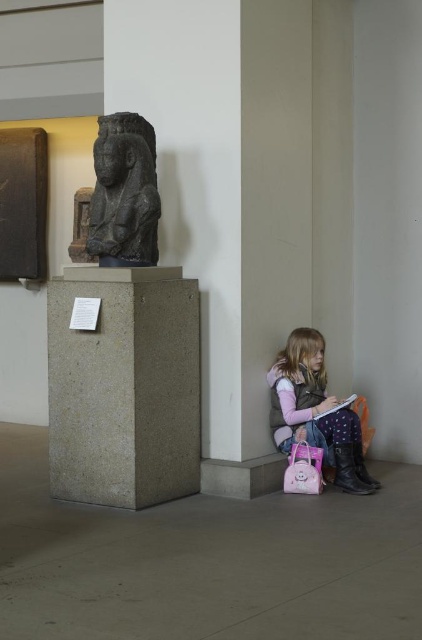
Question: Which of these objects is positioned farthest from the gray concrete pillar at center?

Choices:
 (A) matte pink backpack at lower right
 (B) pink matte book at lower right

Answer: (B)

Question: Is matte pink backpack at lower right thinner than pink matte book at lower right?

Choices:
 (A) yes
 (B) no

Answer: (B)

Question: Which object appears farthest from the camera in this image?

Choices:
 (A) gray concrete pillar at center
 (B) black stone statue at left
 (C) matte pink backpack at lower right
 (D) pink matte book at lower right

Answer: (D)

Question: Does gray concrete pillar at center appear under matte pink backpack at lower right?

Choices:
 (A) yes
 (B) no

Answer: (B)

Question: Does gray concrete pillar at center come in front of matte pink backpack at lower right?

Choices:
 (A) no
 (B) yes

Answer: (B)

Question: Which of the following is the closest to the observer?

Choices:
 (A) (273, 394)
 (B) (127, 177)
 (C) (324, 410)

Answer: (B)